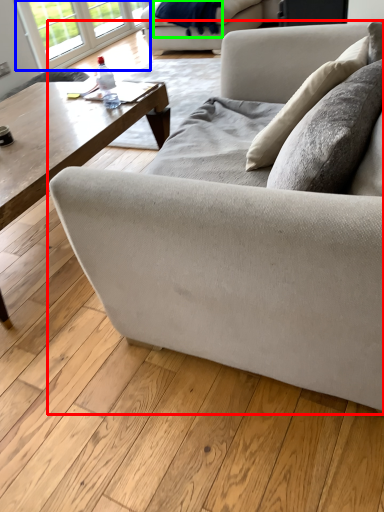
Question: Considering the real-world distances, which object is closest to studio couch (highlighted by a red box)? window (highlighted by a blue box) or blanket (highlighted by a green box).

Choices:
 (A) window
 (B) blanket

Answer: (B)